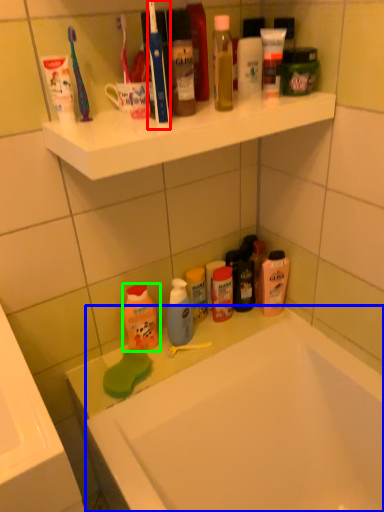
Question: Estimate the real-world distances between objects in this image. Which object is closer to toothbrush (highlighted by a red box), bathtub (highlighted by a blue box) or cleaning product (highlighted by a green box)?

Choices:
 (A) bathtub
 (B) cleaning product

Answer: (B)